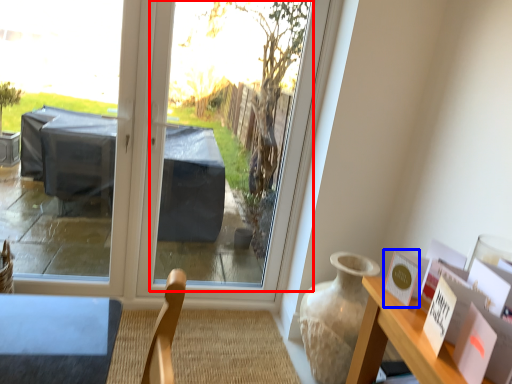
Question: Which of the following is the farthest to the observer, window screen (highlighted by a red box) or postcard (highlighted by a blue box)?

Choices:
 (A) window screen
 (B) postcard

Answer: (A)